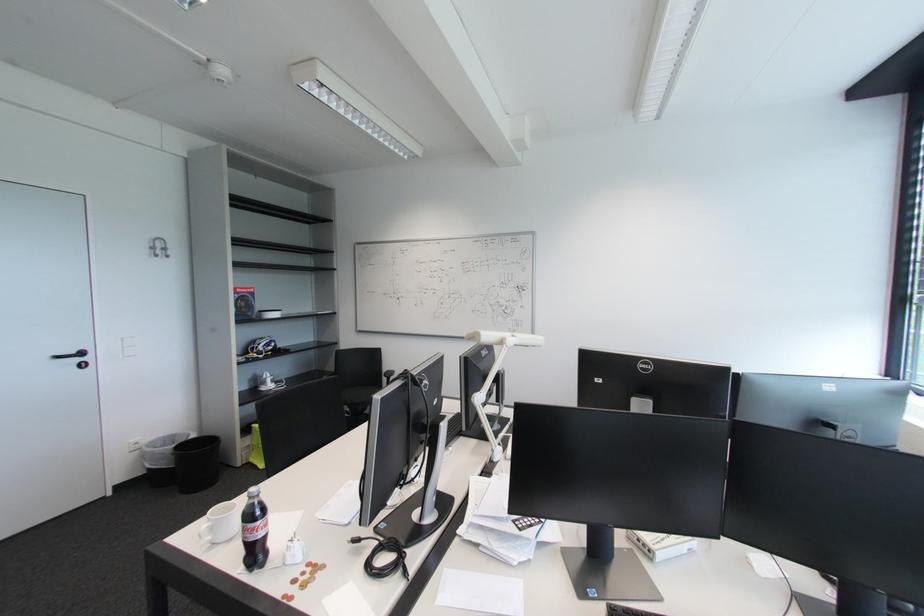
Locate an element on the screen. The height and width of the screenshot is (616, 924). white desk lamp head is located at coordinates (505, 338).